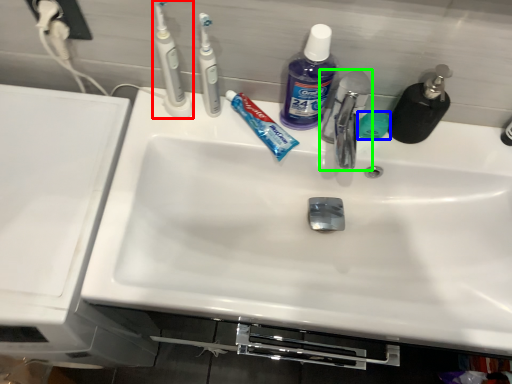
Question: Based on their relative distances, which object is nearer to toothbrush (highlighted by a red box)? Choose from soap (highlighted by a blue box) and tap (highlighted by a green box).

Choices:
 (A) soap
 (B) tap

Answer: (B)